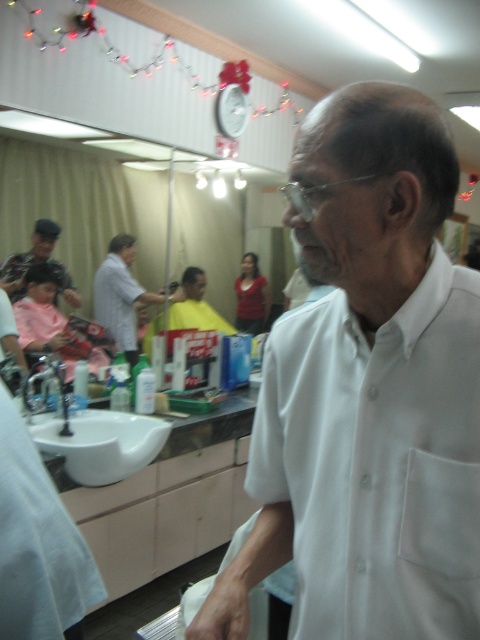
Question: Can you confirm if white smooth shirt at center is positioned to the right of matte black hair at left?

Choices:
 (A) yes
 (B) no

Answer: (A)

Question: Which point is farther to the camera?

Choices:
 (A) light gray shirt at center
 (B) white ceramic sink at lower left

Answer: (A)

Question: Which object is closer to the camera taking this photo?

Choices:
 (A) white smooth shirt at center
 (B) clear plastic glasses at center
 (C) matte black hair at left

Answer: (A)

Question: Is matte black hair at left to the left of white ceramic sink at lower left from the viewer's perspective?

Choices:
 (A) yes
 (B) no

Answer: (A)

Question: Can you confirm if light gray shirt at center is thinner than clear plastic glasses at center?

Choices:
 (A) yes
 (B) no

Answer: (B)

Question: Which of these objects is positioned closest to the matte black hair at left?

Choices:
 (A) white ceramic sink at lower left
 (B) clear plastic glasses at center
 (C) light gray shirt at center
 (D) white smooth shirt at center

Answer: (C)